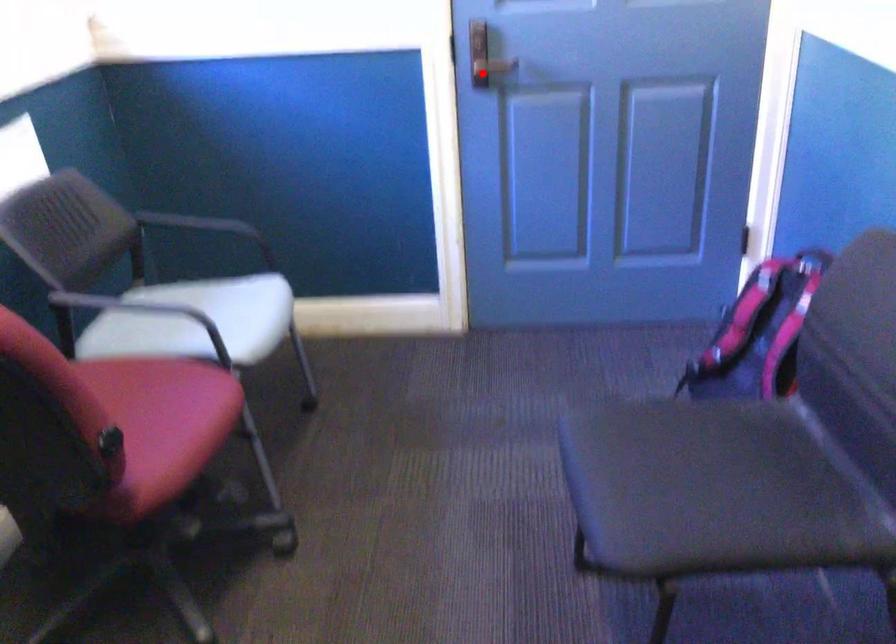
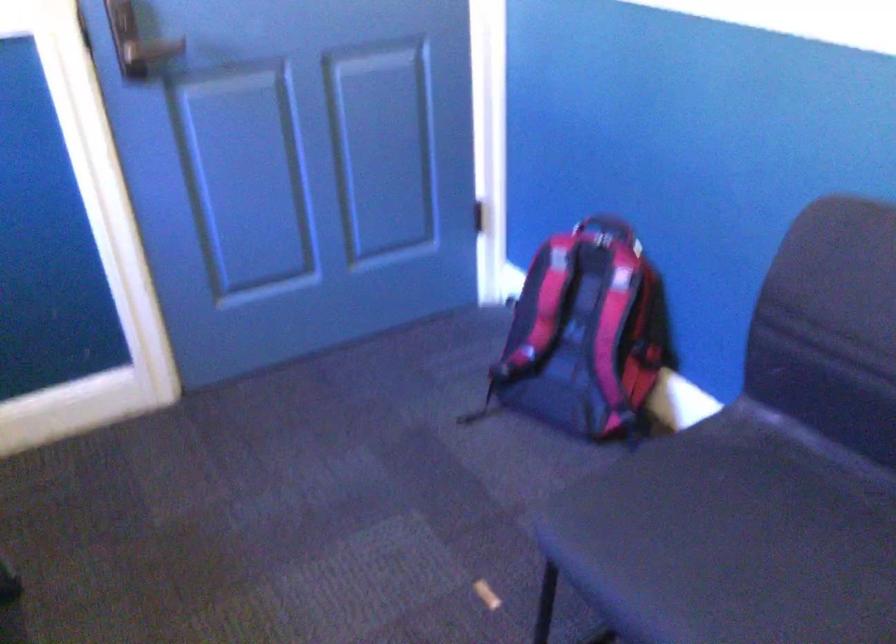
Question: I am providing you with two images of the same scene from different viewpoints. A red point is shown in image1. For the corresponding object point in image2, is it positioned nearer or farther from the camera?

Choices:
 (A) Nearer
 (B) Farther

Answer: (A)